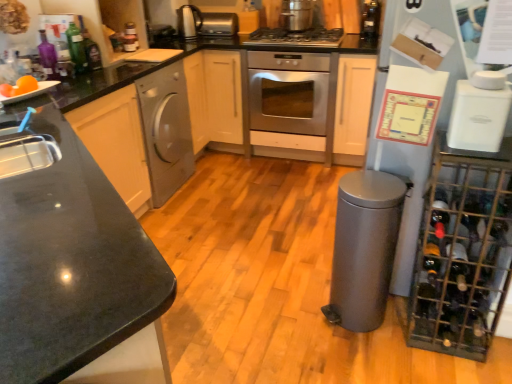
This screenshot has height=384, width=512. What are the coordinates of `free space between metallic wire wine rack at right and satin silver trash can at lower right, the 3th appliance viewed from the back` in the screenshot? It's located at (386, 327).